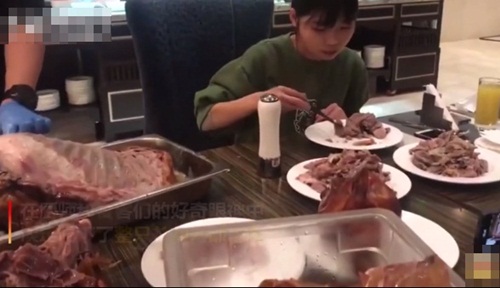
What are the coordinates of `clean plates` in the screenshot? It's located at (51, 101), (80, 93), (373, 52), (359, 50).